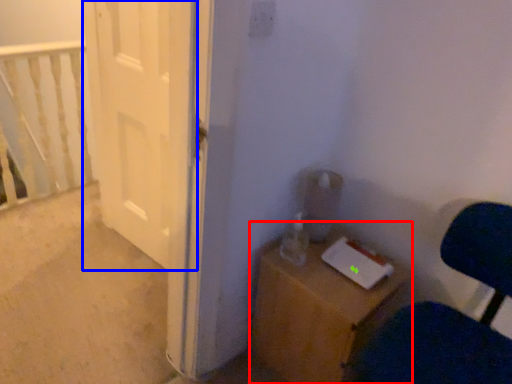
Question: Which point is further to the camera, furniture (highlighted by a red box) or door (highlighted by a blue box)?

Choices:
 (A) furniture
 (B) door

Answer: (B)